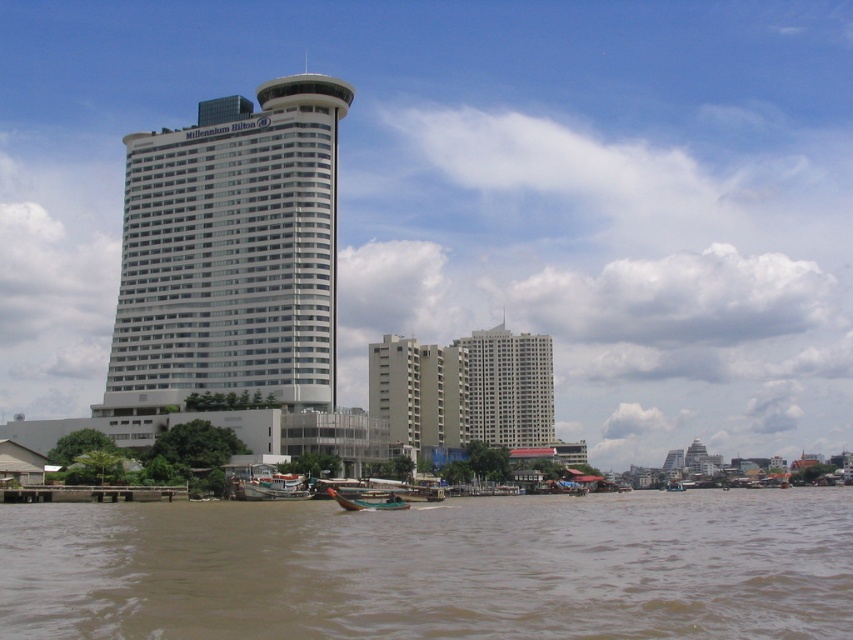
Question: Does white glass building at center appear under white plastic boat at lower center?

Choices:
 (A) yes
 (B) no

Answer: (B)

Question: Where is white glass building at center located in relation to green wooden boat at lower center in the image?

Choices:
 (A) below
 (B) above

Answer: (B)

Question: Which object is the farthest from the brown muddy water at lower center?

Choices:
 (A) white glass building at center
 (B) white plastic boat at lower center
 (C) green wooden boat at lower center

Answer: (A)

Question: Estimate the real-world distances between objects in this image. Which object is closer to the white smooth building at center?

Choices:
 (A) green wooden boat at lower center
 (B) white plastic boat at lower center

Answer: (B)

Question: Among these points, which one is farthest from the camera?

Choices:
 (A) (518, 365)
 (B) (279, 484)
 (C) (67, 636)

Answer: (A)

Question: In this image, where is brown muddy water at lower center located relative to white plastic boat at lower center?

Choices:
 (A) below
 (B) above

Answer: (B)